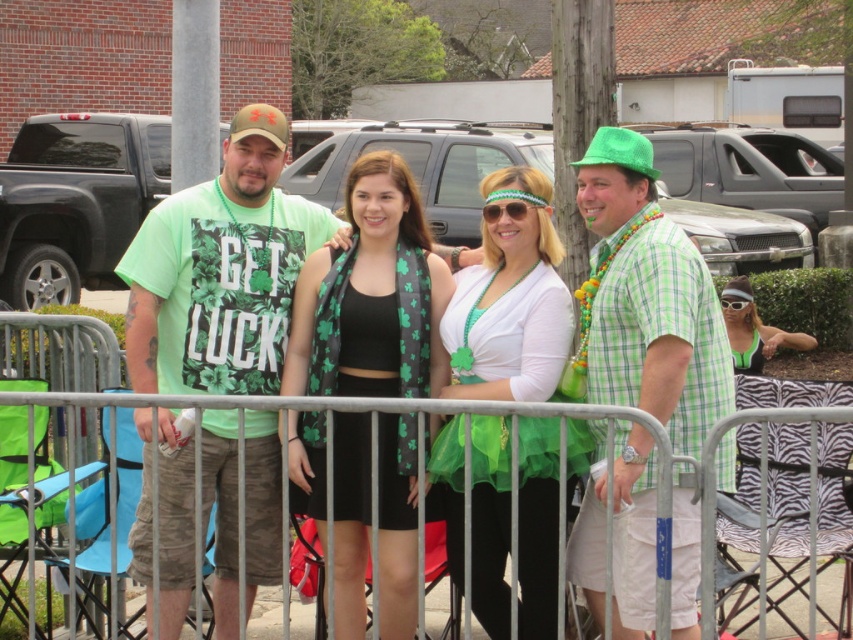
Can you confirm if black matte scarf at center is taller than green fabric bikini top at right?

Yes, black matte scarf at center is taller than green fabric bikini top at right.

In the scene shown: Is black matte scarf at center above green fabric bikini top at right?

No, black matte scarf at center is not above green fabric bikini top at right.

Measure the distance between black matte scarf at center and camera.

A distance of 5.34 meters exists between black matte scarf at center and camera.

At what (x,y) coordinates should I click in order to perform the action: click on black matte scarf at center. Please return your answer as a coordinate pair (x, y). Looking at the image, I should click on (370, 296).

Between green plaid shirt at center and green fabric bikini top at right, which one is positioned lower?

green plaid shirt at center is lower down.

Is point (595, 225) positioned behind point (746, 365)?

No, it is not.

Is point (599, 376) positioned behind point (775, 344)?

No.

Identify the location of green plaid shirt at center. (646, 300).

Which is below, green plaid shirt at center or metallic silver fence at center?

metallic silver fence at center is below.

You are a GUI agent. You are given a task and a screenshot of the screen. Output one action in this format:
    pyautogui.click(x=<x>, y=<y>)
    Task: Click on the green plaid shirt at center
    The width and height of the screenshot is (853, 640).
    Given the screenshot: What is the action you would take?
    pyautogui.click(x=646, y=300)